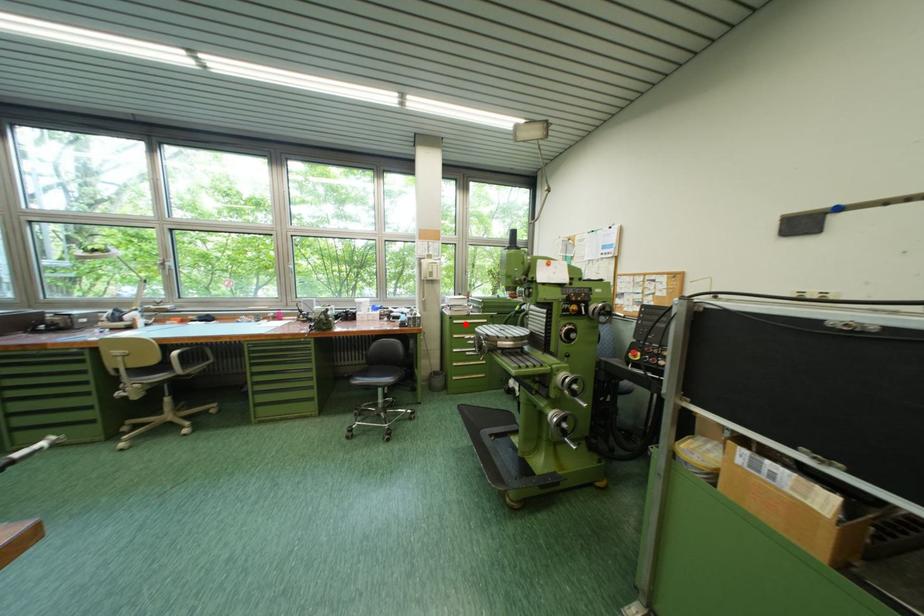
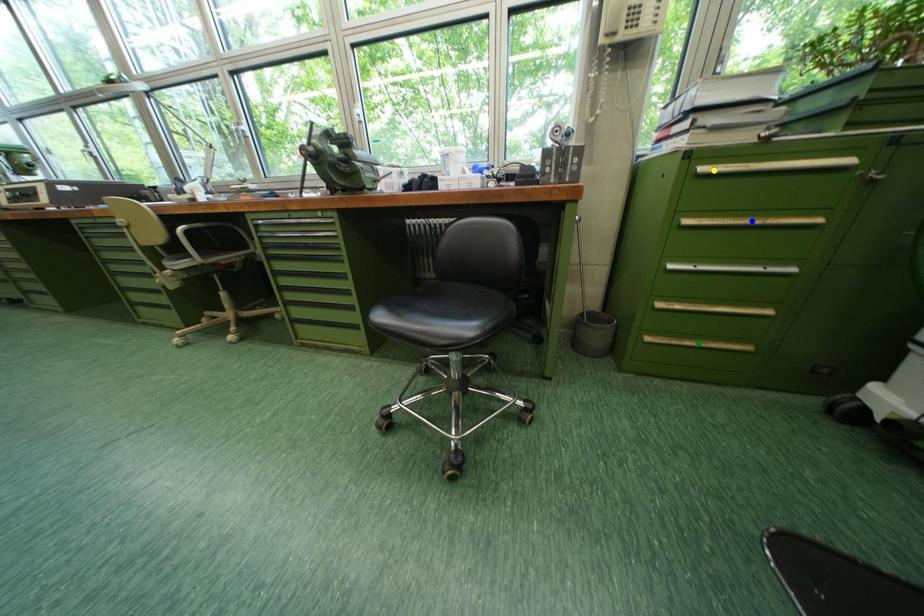
Question: I am providing you with two images of the same scene from different viewpoints. A red point is marked on the first image. You are given multiple points on the second image. Can you choose the point in image 2 that corresponds to the point in image 1?

Choices:
 (A) blue point
 (B) yellow point
 (C) green point

Answer: (B)